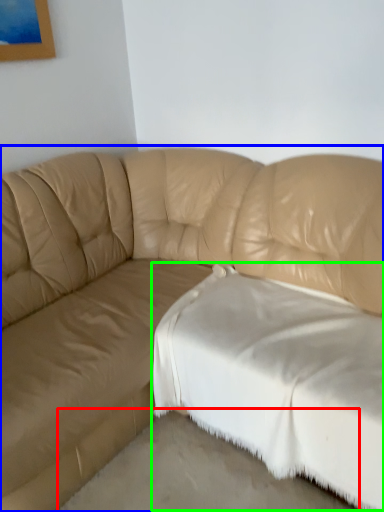
Question: Which object is the closest to the concrete (highlighted by a red box)? Choose among these: studio couch (highlighted by a blue box) or sheet (highlighted by a green box).

Choices:
 (A) studio couch
 (B) sheet

Answer: (B)